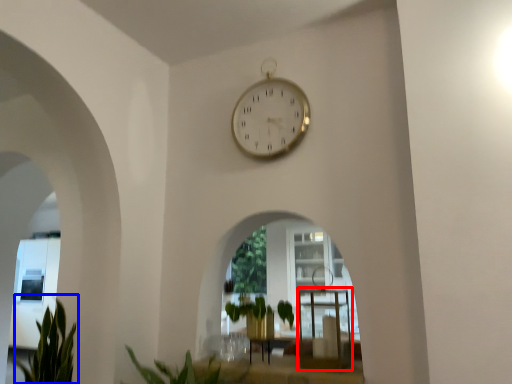
Question: Which of the following is the closest to the observer, table (highlighted by a red box) or plant (highlighted by a blue box)?

Choices:
 (A) table
 (B) plant

Answer: (A)